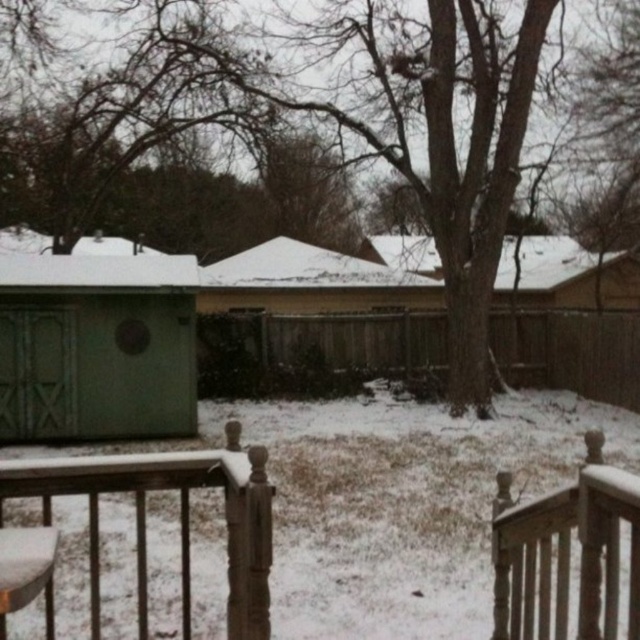
Consider the image. You are standing on the wooden deck and want to move from the wooden railing at lower center to the white wood railing at lower right. Which railing has a wider width that might make it easier to hold onto?

The wooden railing at lower center has a larger width than the white wood railing at lower right, so it might be easier to hold onto.

You are standing on the wooden deck and want to look at the snow on the ground. Which railing, the wooden railing at lower center or the white wood railing at lower right, is closer to your eyes?

The wooden railing at lower center is closer to your eyes because it is positioned under the white wood railing at lower right, meaning it is in front of the other railing.

From the picture: You are standing on the wooden deck and want to place a small potted plant between the wooden railing at lower center and the white wood railing at lower right. Which railing should the plant be closer to if you want it to be protected from the wind coming from the taller railing side?

The wooden railing at lower center is much taller than the white wood railing at lower right. To protect the small potted plant from the wind coming from the taller railing side, place it closer to the white wood railing at lower right so it is sheltered from the stronger winds coming over the taller wooden railing at lower center.